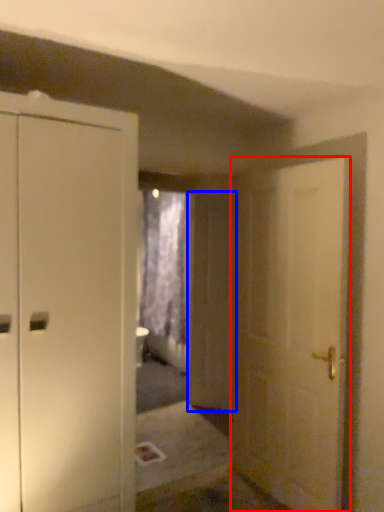
Question: Which of the following is the farthest to the observer, door (highlighted by a red box) or screen door (highlighted by a blue box)?

Choices:
 (A) door
 (B) screen door

Answer: (B)